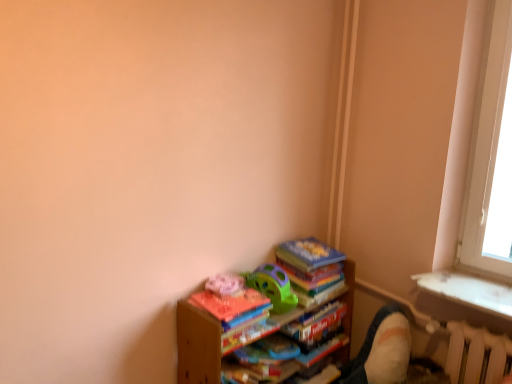
Question: Can you confirm if hardcover book at lower center is wider than white plastic radiator at lower right?

Choices:
 (A) yes
 (B) no

Answer: (A)

Question: Does hardcover book at lower center appear on the left side of white plastic radiator at lower right?

Choices:
 (A) no
 (B) yes

Answer: (B)

Question: Would you consider hardcover book at lower center to be distant from white plastic radiator at lower right?

Choices:
 (A) yes
 (B) no

Answer: (B)

Question: From a real-world perspective, is hardcover book at lower center over white plastic radiator at lower right?

Choices:
 (A) yes
 (B) no

Answer: (B)

Question: Is hardcover book at lower center at the right side of white plastic radiator at lower right?

Choices:
 (A) yes
 (B) no

Answer: (B)

Question: From the image's perspective, is hardcover book at lower center under white plastic radiator at lower right?

Choices:
 (A) yes
 (B) no

Answer: (B)

Question: From the image's perspective, does green plastic toy at center appear higher than velvet beige swivel chair at lower right?

Choices:
 (A) no
 (B) yes

Answer: (B)

Question: From a real-world perspective, does green plastic toy at center stand above velvet beige swivel chair at lower right?

Choices:
 (A) yes
 (B) no

Answer: (A)

Question: Is velvet beige swivel chair at lower right a part of green plastic toy at center?

Choices:
 (A) no
 (B) yes

Answer: (A)

Question: Considering the relative sizes of green plastic toy at center and velvet beige swivel chair at lower right in the image provided, is green plastic toy at center smaller than velvet beige swivel chair at lower right?

Choices:
 (A) yes
 (B) no

Answer: (A)

Question: Would you consider green plastic toy at center to be distant from velvet beige swivel chair at lower right?

Choices:
 (A) yes
 (B) no

Answer: (B)

Question: Could you tell me if green plastic toy at center is turned towards velvet beige swivel chair at lower right?

Choices:
 (A) yes
 (B) no

Answer: (B)

Question: Considering the relative sizes of velvet beige swivel chair at lower right and wooden books at lower right in the image provided, is velvet beige swivel chair at lower right taller than wooden books at lower right?

Choices:
 (A) yes
 (B) no

Answer: (B)